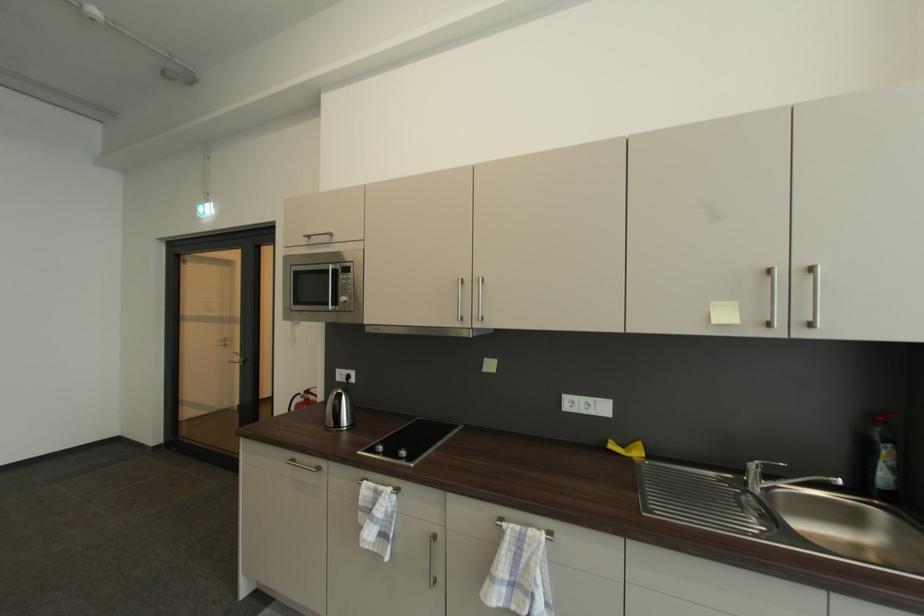
The height and width of the screenshot is (616, 924). Describe the element at coordinates (772, 296) in the screenshot. I see `a door handle` at that location.